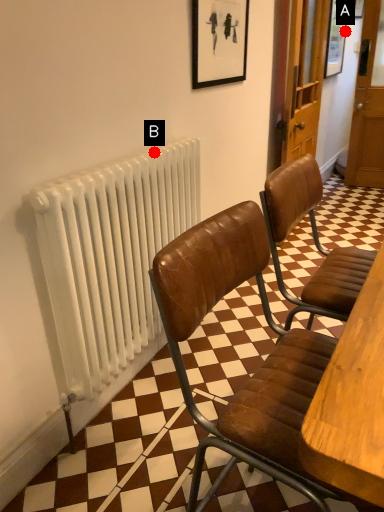
Question: Two points are circled on the image, labeled by A and B beside each circle. Which point appears farthest from the camera in this image?

Choices:
 (A) A is further
 (B) B is further

Answer: (A)